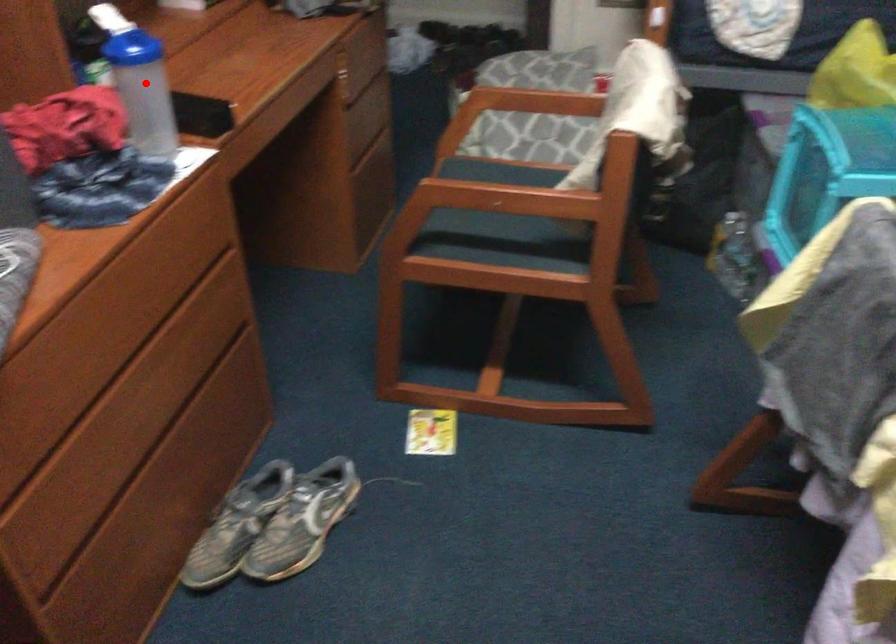
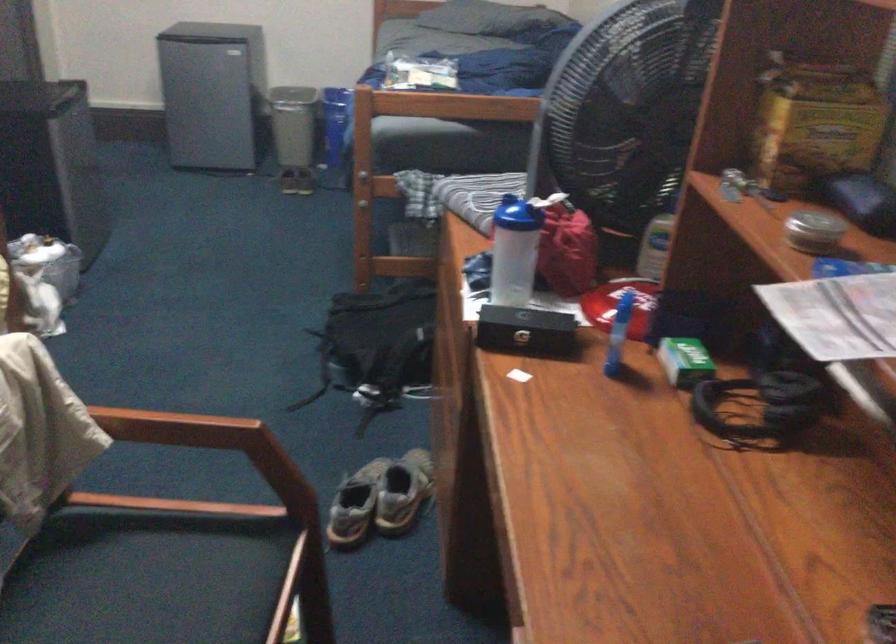
Find the pixel in the second image that matches the highlighted location in the first image.

(513, 251)